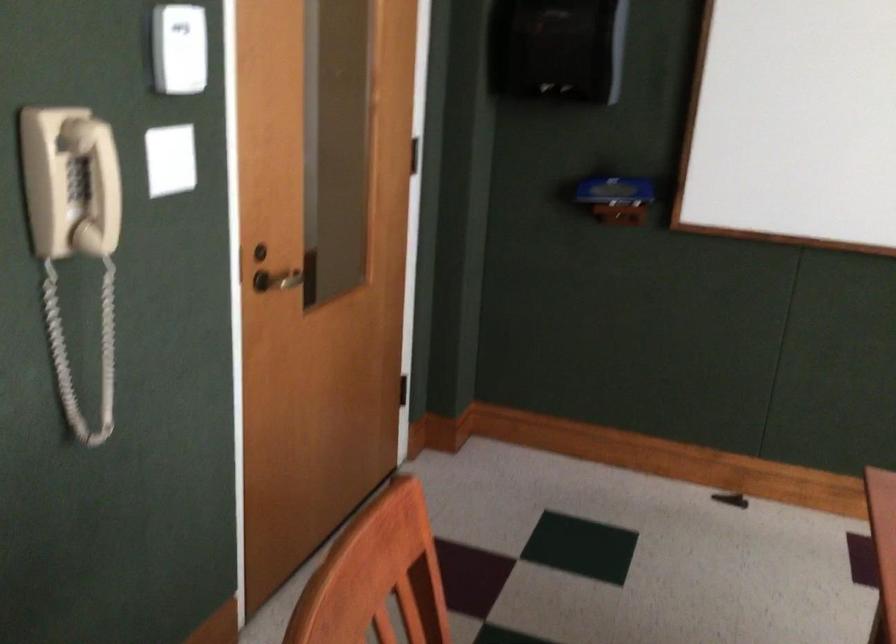
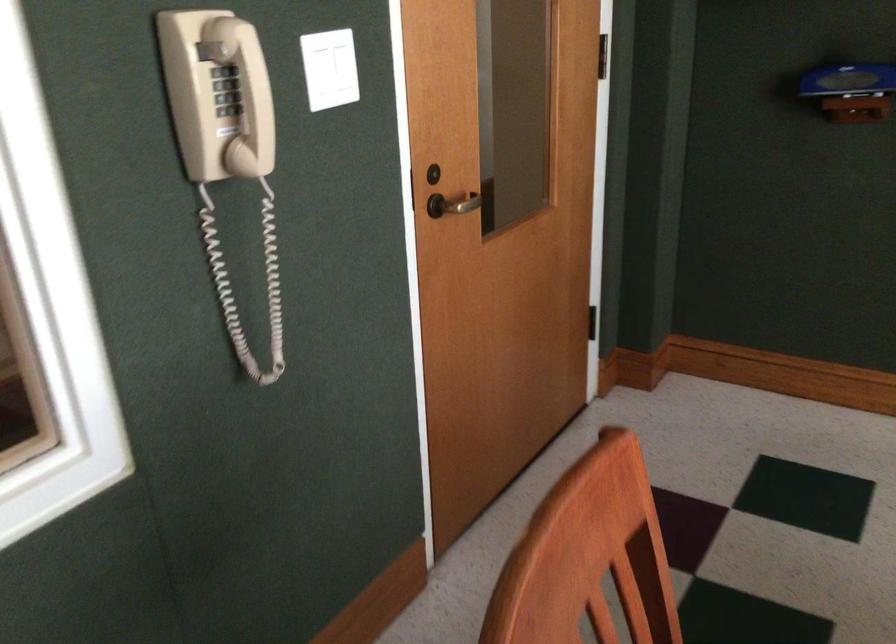
The point at [179,171] is marked in the first image. Where is the corresponding point in the second image?

(330, 69)